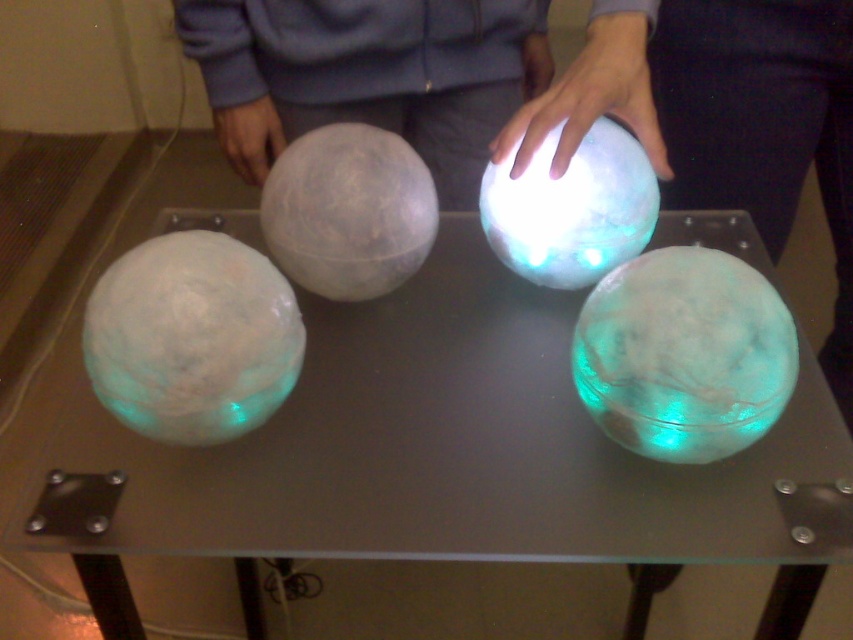
You are standing in front of the table and want to place a small note on the table near the translucent glass spheres at center. Considering their exact position, where should you place the note to ensure it doesn not interfere with the spheres?

The translucent glass spheres at center are located at point (440,460). To avoid interference, place the note in an area away from this coordinate, such as the edges or corners of the table not occupied by the spheres.

You are a delivery person who needs to place a new package on the table between the translucent glass spheres at center and the matte gray sphere at center. The package is 15 inches long. Will it fit in the space between them?

The distance between the translucent glass spheres at center and the matte gray sphere at center is 14.50 inches. Since the package is 15 inches long, it will not fit in the space between them.

You are standing in front of a glass table with translucent glass spheres at center. You want to place a small decorative item on the table without touching the spheres. Given that the distance between you and the spheres is 25.33 inches, what is the minimum distance you should maintain from the spheres to ensure the item is placed safely?

The minimum distance you should maintain from the translucent glass spheres at center is 25.33 inches to ensure the item is placed safely.